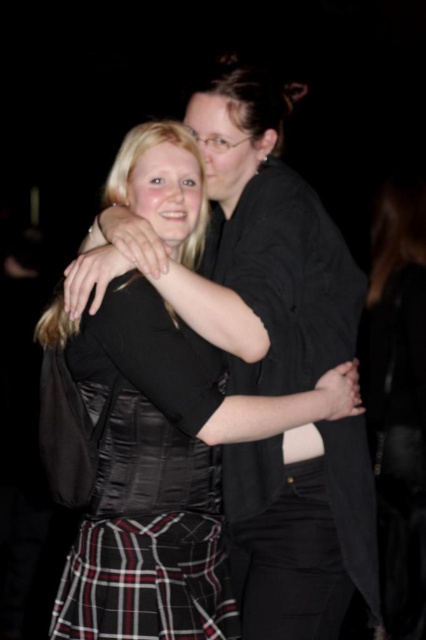
Is point (98, 540) positioned behind point (95, 529)?

No, (98, 540) is in front of (95, 529).

Who is positioned more to the left, satin black dress at center or plaid fabric dress at center?

From the viewer's perspective, plaid fabric dress at center appears more on the left side.

Between point (166, 192) and point (103, 536), which one is positioned behind?

The point (166, 192) is more distant.

Where is `satin black dress at center`? satin black dress at center is located at coordinates (149, 465).

Can you confirm if plaid fabric dress at center is positioned to the right of plaid fabric kilt at lower center?

Incorrect, plaid fabric dress at center is not on the right side of plaid fabric kilt at lower center.

How much distance is there between plaid fabric dress at center and plaid fabric kilt at lower center?

plaid fabric dress at center and plaid fabric kilt at lower center are 8.54 centimeters apart from each other.

Does point (66, 570) lie behind point (98, 602)?

Yes, point (66, 570) is behind point (98, 602).

Where is `plaid fabric dress at center`? plaid fabric dress at center is located at coordinates (146, 481).

Can you confirm if satin black dress at center is shorter than plaid fabric kilt at lower center?

No.

Between point (45, 436) and point (77, 616), which one is positioned in front?

Point (77, 616)

The image size is (426, 640). Identify the location of satin black dress at center. (149, 465).

Image resolution: width=426 pixels, height=640 pixels. What are the coordinates of `satin black dress at center` in the screenshot? It's located at (149, 465).